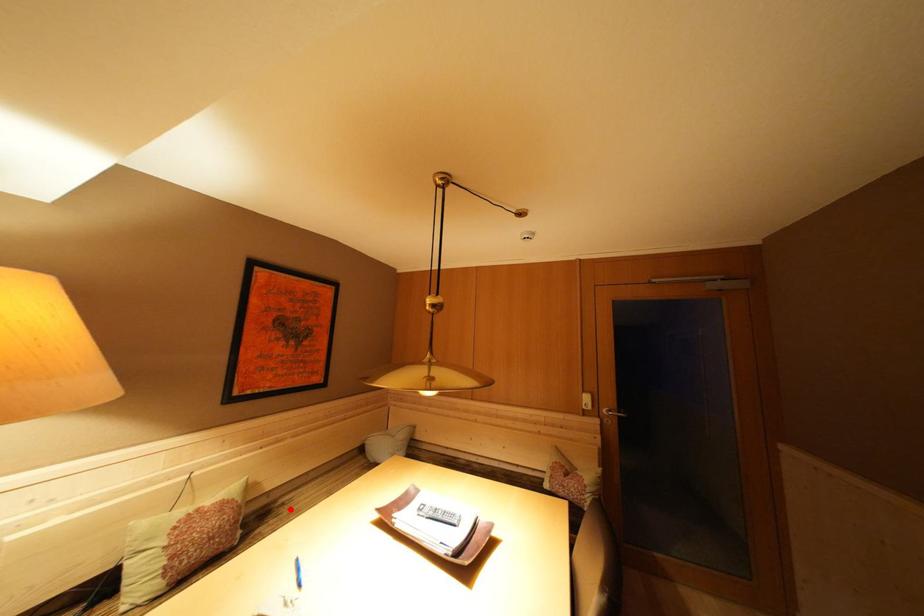
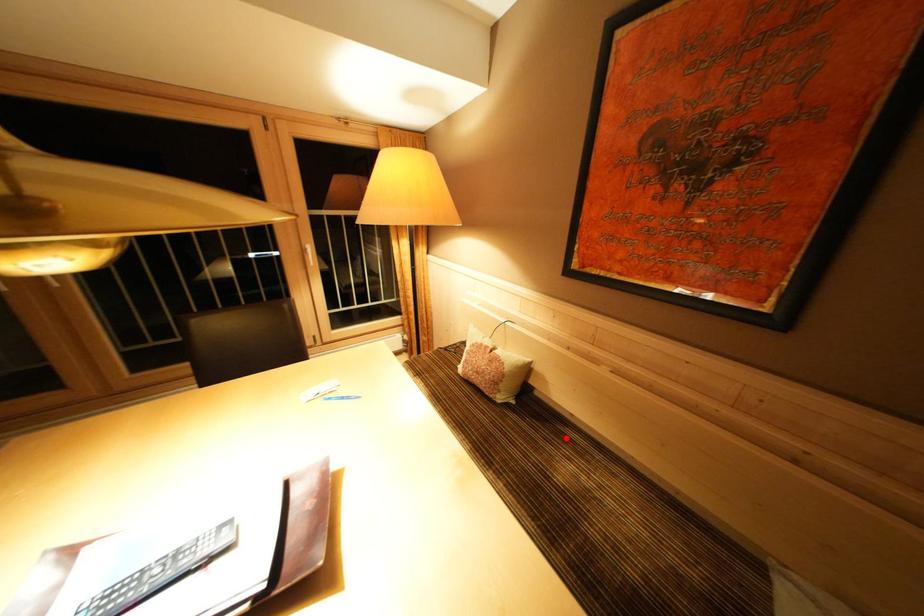
I am providing you with two images of the same scene from different viewpoints. A red point is marked on the first image and another point is marked on the second image. Are the points marked in image1 and image2 representing the same 3D position?

Yes